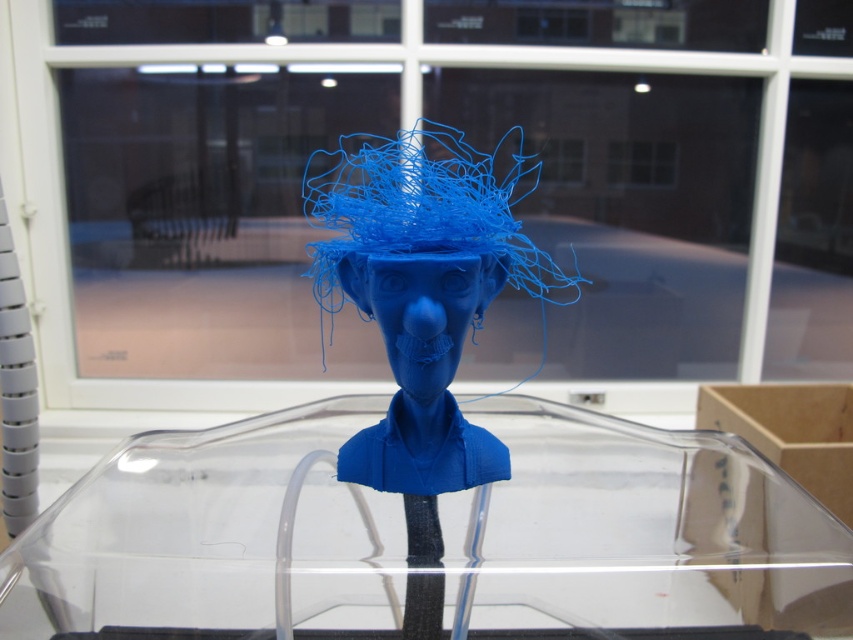
You are an art curator preparing to display the matte plastic bust at center and the matte blue bust at center in an exhibition. Which of the two busts should be placed in a larger display case to accommodate its size?

The matte plastic bust at center is bigger than the matte blue bust at center, so it should be placed in a larger display case.

You are standing in front of the 3D printed bust and want to take a photo of it. The camera you are using has a focal length of 50mm. If you want to capture the entire bust in the photo without cropping, what is the minimum distance you should maintain from the camera to the point at coordinates point (277, 560)? Provide your answer in inches.

The point at coordinates point (277, 560) is 10.65 inches away from the camera. To capture the entire bust without cropping, you should maintain a distance of at least 10.65 inches from the camera to the point at coordinates point (277, 560).

You are an art conservator examining the 3D printed bust. You notice two points of concern labeled as point 1 and point 2. Point 1 is at coordinate point (526, 440) and point 2 is at coordinate point (440, 230). If you were to touch both points with a tool, which point would require you to extend your tool further out to reach?

Point (440, 230) would require extending the tool further because it is positioned farther away from the viewer compared to point (526, 440), which is closer.